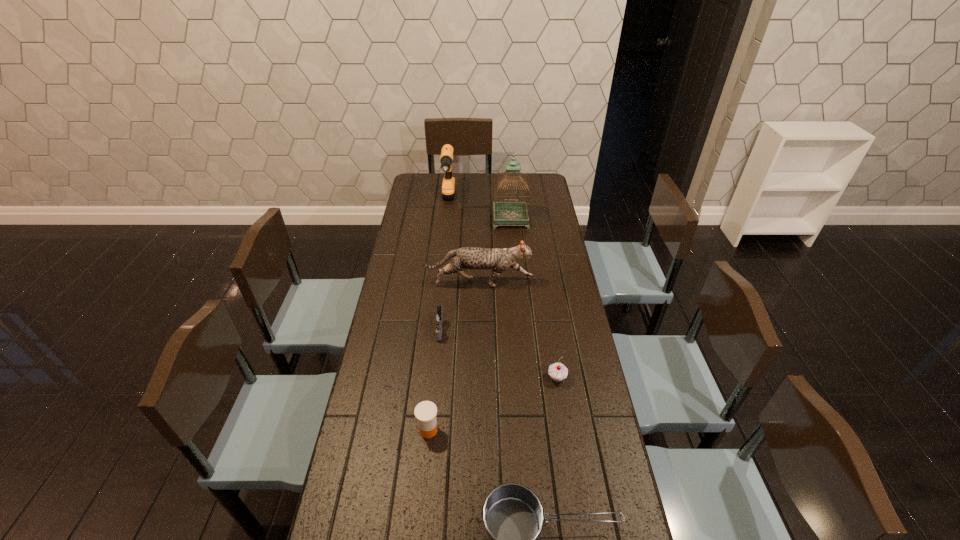
The image size is (960, 540). In order to click on birdcage in this screenshot , I will do [506, 213].

Where is `the sixth shortest object`? This screenshot has height=540, width=960. the sixth shortest object is located at coordinates (448, 186).

Where is `the fifth nearest object`? the fifth nearest object is located at coordinates (499, 260).

Find the location of `the fifth shortest object`. the fifth shortest object is located at coordinates (499, 260).

This screenshot has width=960, height=540. In order to click on igniter in this screenshot , I will do `click(438, 318)`.

The height and width of the screenshot is (540, 960). I want to click on the second nearest object, so click(425, 412).

Where is `cupcake`? The width and height of the screenshot is (960, 540). cupcake is located at coordinates (557, 371).

The image size is (960, 540). What are the coordinates of `free spot located 0.050m at the door of the birdcage` in the screenshot? It's located at coord(512,235).

At what (x,y) coordinates should I click in order to perform the action: click on vacant space located 0.180m at the tip of the drill. Please return your answer as a coordinate pair (x, y). The width and height of the screenshot is (960, 540). Looking at the image, I should click on (444, 242).

Where is `free space located 0.060m on the face of the third farthest object`? free space located 0.060m on the face of the third farthest object is located at coordinates (548, 282).